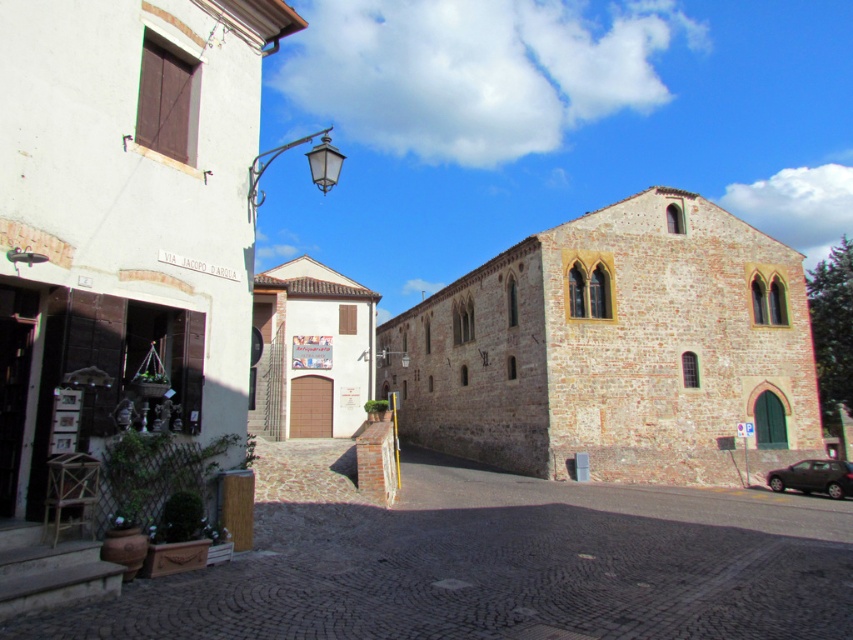
Question: Which point appears farthest from the camera in this image?

Choices:
 (A) (851, 481)
 (B) (328, 280)
 (C) (816, 412)

Answer: (B)

Question: Which object appears closest to the camera in this image?

Choices:
 (A) shiny black car at lower right
 (B) cobblestone alley at lower left

Answer: (B)

Question: Is white stone church at left further to camera compared to white matte church at center?

Choices:
 (A) no
 (B) yes

Answer: (A)

Question: Can you confirm if cobblestone alley at lower left is positioned to the right of brown stone church at center?

Choices:
 (A) yes
 (B) no

Answer: (A)

Question: Is brown stone church at center wider than shiny black car at lower right?

Choices:
 (A) yes
 (B) no

Answer: (A)

Question: Which of the following is the farthest from the observer?

Choices:
 (A) brown stone church at center
 (B) white stone church at left

Answer: (A)